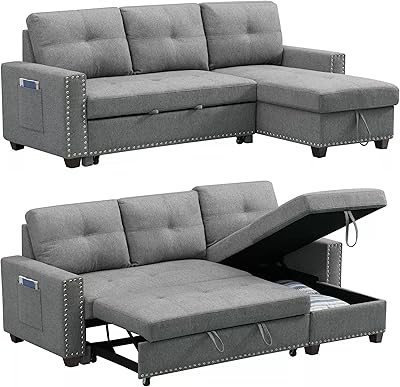
Identify the location of blanket. coord(310,300).